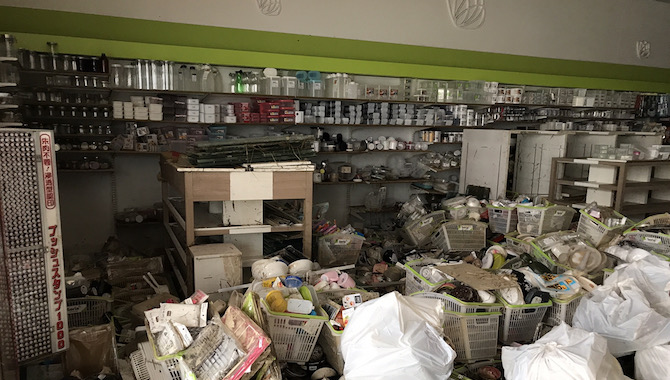
The width and height of the screenshot is (670, 380). Identify the location of middle rack. (206, 184), (618, 162).